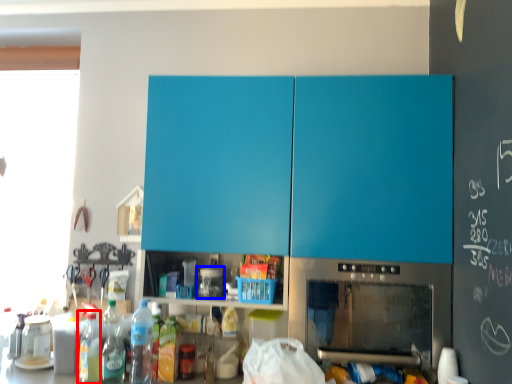
Question: Which object is closer to the camera taking this photo, bottle (highlighted by a red box) or appliance (highlighted by a blue box)?

Choices:
 (A) bottle
 (B) appliance

Answer: (A)